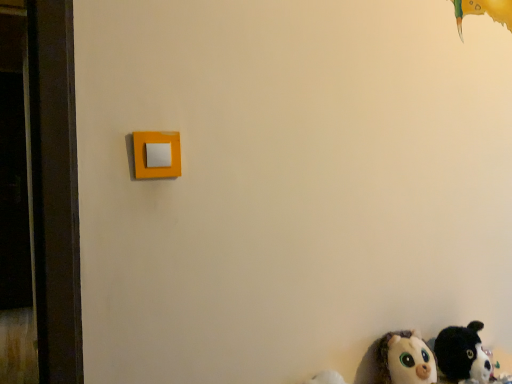
Question: From a real-world perspective, is fluffy plush cat at lower right, which is the first toy in right-to-left order, above or below white plush toy at lower right, which appears as the second toy when viewed from the right?

Choices:
 (A) above
 (B) below

Answer: (A)

Question: Relative to white plush toy at lower right, which appears as the first toy when viewed from the left, is fluffy plush cat at lower right, which is the first toy in right-to-left order, in front or behind?

Choices:
 (A) behind
 (B) front

Answer: (A)

Question: Is fluffy plush cat at lower right, which is the 2th toy in left-to-right order, wider or thinner than white plush toy at lower right, which appears as the second toy when viewed from the right?

Choices:
 (A) thin
 (B) wide

Answer: (B)

Question: In terms of width, does white plush toy at lower right, which appears as the first toy when viewed from the left, look wider or thinner when compared to fluffy plush cat at lower right, which is the 2th toy in left-to-right order?

Choices:
 (A) wide
 (B) thin

Answer: (B)

Question: From a real-world perspective, relative to fluffy plush cat at lower right, which is the 2th toy in left-to-right order, is white plush toy at lower right, which appears as the second toy when viewed from the right, vertically above or below?

Choices:
 (A) above
 (B) below

Answer: (B)

Question: Considering the positions of point (433, 380) and point (466, 370), is point (433, 380) closer or farther from the camera than point (466, 370)?

Choices:
 (A) closer
 (B) farther

Answer: (A)

Question: From the image's perspective, is white plush toy at lower right, which appears as the first toy when viewed from the left, located above or below fluffy plush cat at lower right, which is the first toy in right-to-left order?

Choices:
 (A) below
 (B) above

Answer: (A)